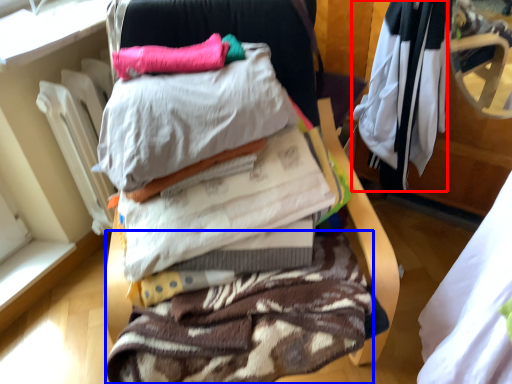
Question: Which of the following is the closest to the observer, clothing (highlighted by a red box) or clothing (highlighted by a blue box)?

Choices:
 (A) clothing
 (B) clothing

Answer: (B)